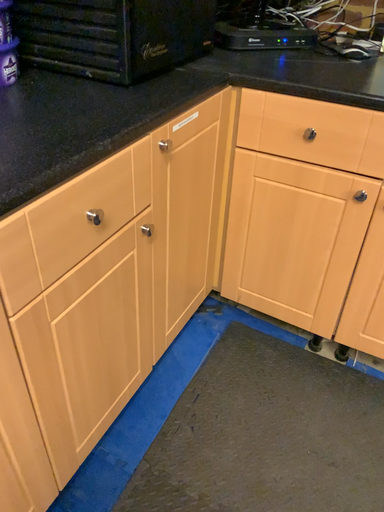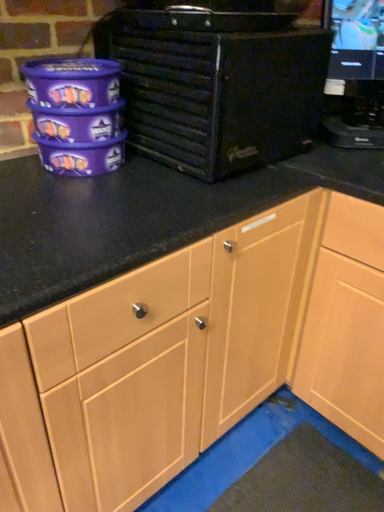
Question: How did the camera likely rotate when shooting the video?

Choices:
 (A) rotated right
 (B) rotated left

Answer: (B)